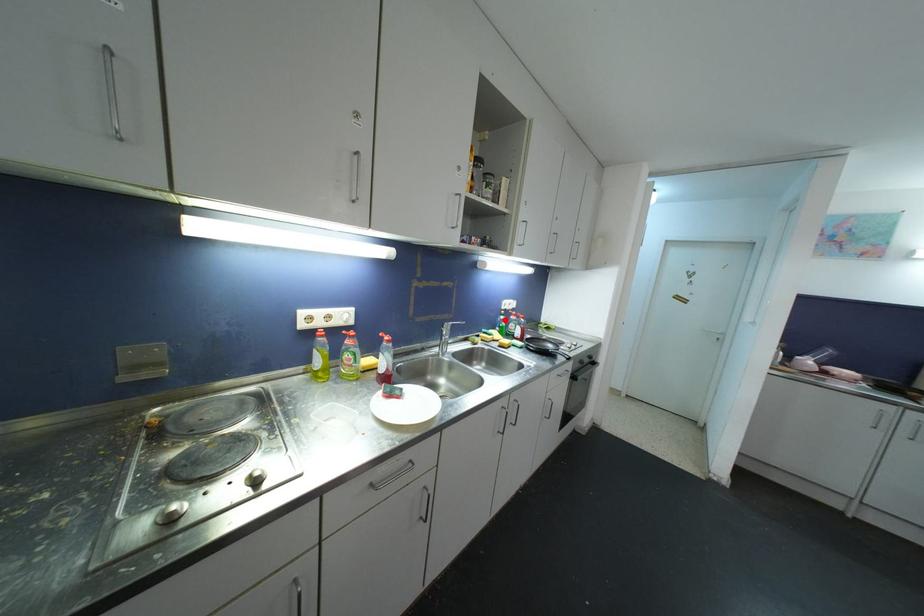
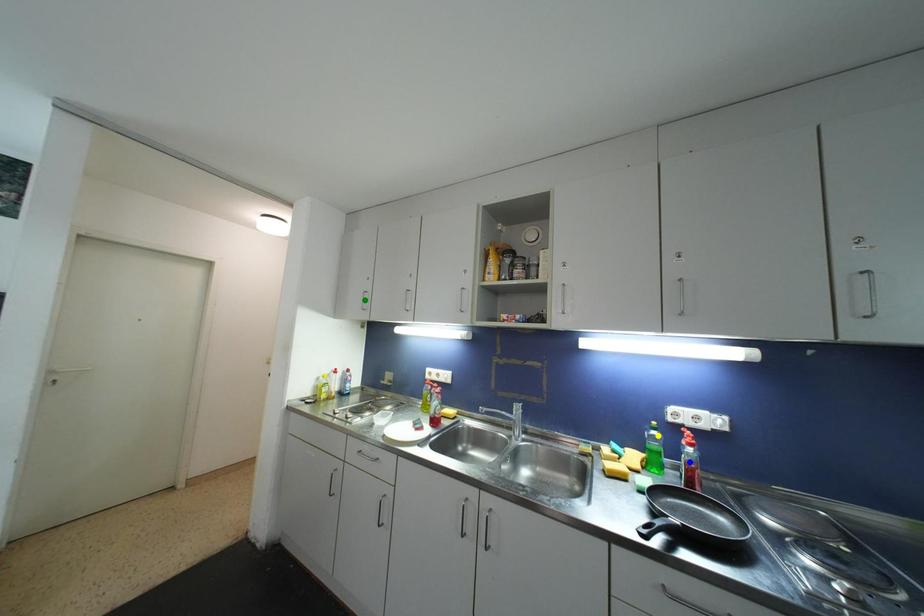
Question: I am providing you with two images of the same scene from different viewpoints. A red point is marked on the first image. You are given multiple points on the second image. Which point in image 2 represents the same 3d spot as the red point in image 1?

Choices:
 (A) yellow point
 (B) green point
 (C) blue point

Answer: (A)